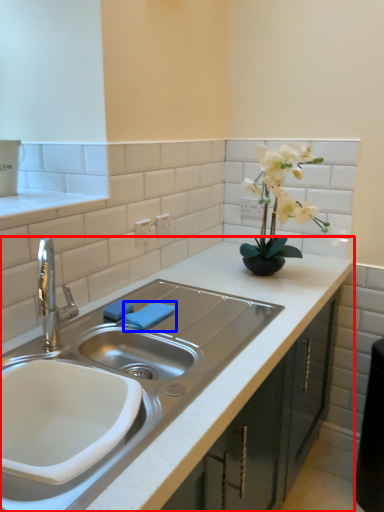
Question: Which of the following is the closest to the observer, countertop (highlighted by a red box) or towel bar (highlighted by a blue box)?

Choices:
 (A) countertop
 (B) towel bar

Answer: (A)